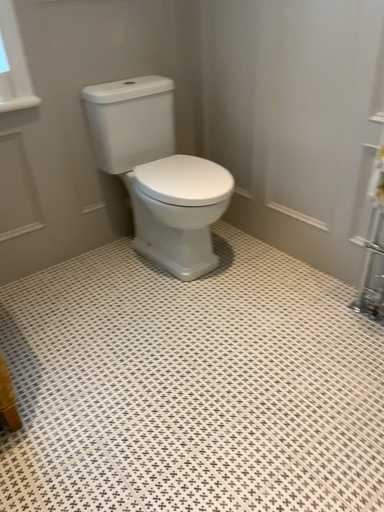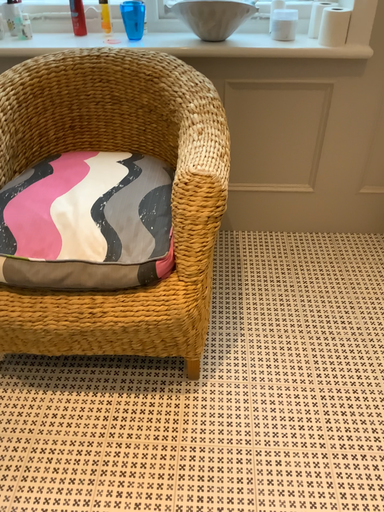
Question: How did the camera likely rotate when shooting the video?

Choices:
 (A) rotated right
 (B) rotated left

Answer: (B)